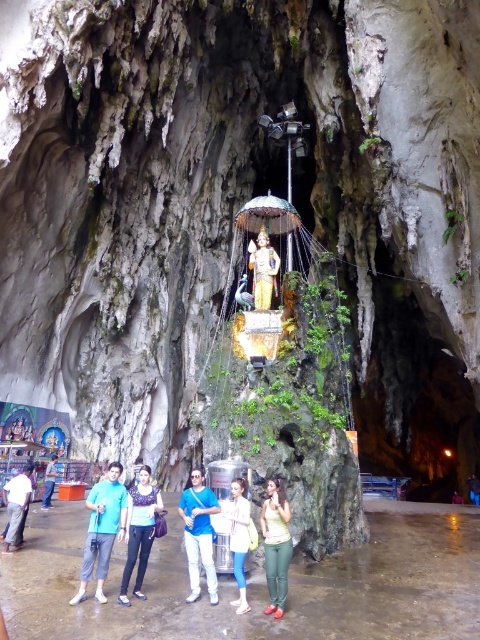
You are a photographer trying to capture the golden statue of a deity in the center of the cave. You notice a point at coordinates (101, 529) in your camera viewfinder. Based on the scene, what object is this point likely located on?

The point at coordinates (101, 529) is located on the blue cotton shirt at center, which is part of a tourist standing in front of the golden statue.

You are a photographer trying to capture a group photo of the tourists in the cave. The tourists are wearing a white matte jacket at center and a white cotton shirt at lower left. Which clothing item has a narrower width at the torso area?

The white matte jacket at center is thinner than the white cotton shirt at lower left, so the white matte jacket at center has a narrower width at the torso area.